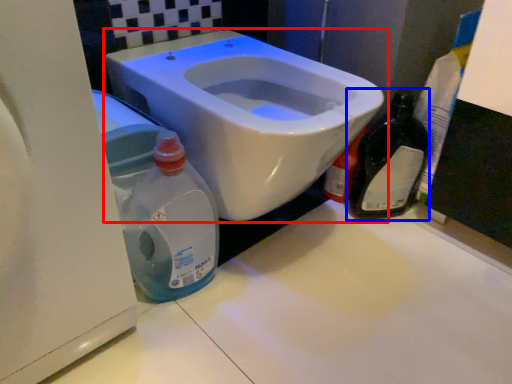
Question: Which point is further to the camera, toilet (highlighted by a red box) or bottle (highlighted by a blue box)?

Choices:
 (A) toilet
 (B) bottle

Answer: (B)